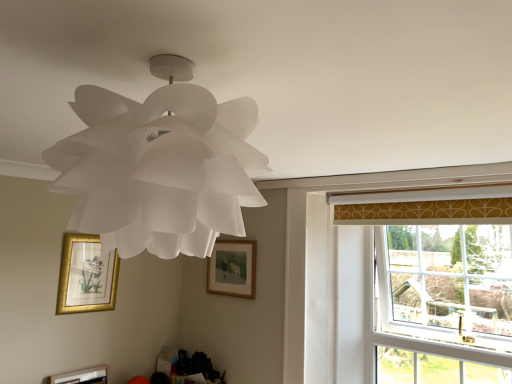
Question: Could you tell me if clear glass window at right is facing white paper lamp at upper center?

Choices:
 (A) no
 (B) yes

Answer: (B)

Question: Does clear glass window at right have a lesser height compared to white paper lamp at upper center?

Choices:
 (A) yes
 (B) no

Answer: (B)

Question: Is clear glass window at right to the right of white paper lamp at upper center from the viewer's perspective?

Choices:
 (A) no
 (B) yes

Answer: (B)

Question: Is clear glass window at right next to white paper lamp at upper center and touching it?

Choices:
 (A) yes
 (B) no

Answer: (B)

Question: Does clear glass window at right have a lesser width compared to white paper lamp at upper center?

Choices:
 (A) no
 (B) yes

Answer: (B)

Question: Is white paper lamp at upper center a part of clear glass window at right?

Choices:
 (A) no
 (B) yes

Answer: (A)

Question: From the image's perspective, is wooden framed picture at center, the 1th picture frame when ordered from top to bottom, on white paper lamp at upper center?

Choices:
 (A) yes
 (B) no

Answer: (B)

Question: Does wooden framed picture at center, the first picture frame viewed from the right, lie in front of white paper lamp at upper center?

Choices:
 (A) no
 (B) yes

Answer: (A)

Question: Are wooden framed picture at center, which is counted as the third picture frame, starting from the bottom, and white paper lamp at upper center beside each other?

Choices:
 (A) yes
 (B) no

Answer: (B)

Question: Does wooden framed picture at center, which is counted as the third picture frame, starting from the bottom, have a lesser width compared to white paper lamp at upper center?

Choices:
 (A) yes
 (B) no

Answer: (A)

Question: Would you say wooden framed picture at center, the first picture frame viewed from the right, is outside white paper lamp at upper center?

Choices:
 (A) no
 (B) yes

Answer: (B)

Question: Does wooden framed picture at center, which is counted as the third picture frame, starting from the bottom, appear on the left side of white paper lamp at upper center?

Choices:
 (A) yes
 (B) no

Answer: (B)

Question: From a real-world perspective, is wooden framed picture at center, the first picture frame viewed from the right, over wooden picture frame at lower left, which is the 3th picture frame from top to bottom?

Choices:
 (A) no
 (B) yes

Answer: (B)